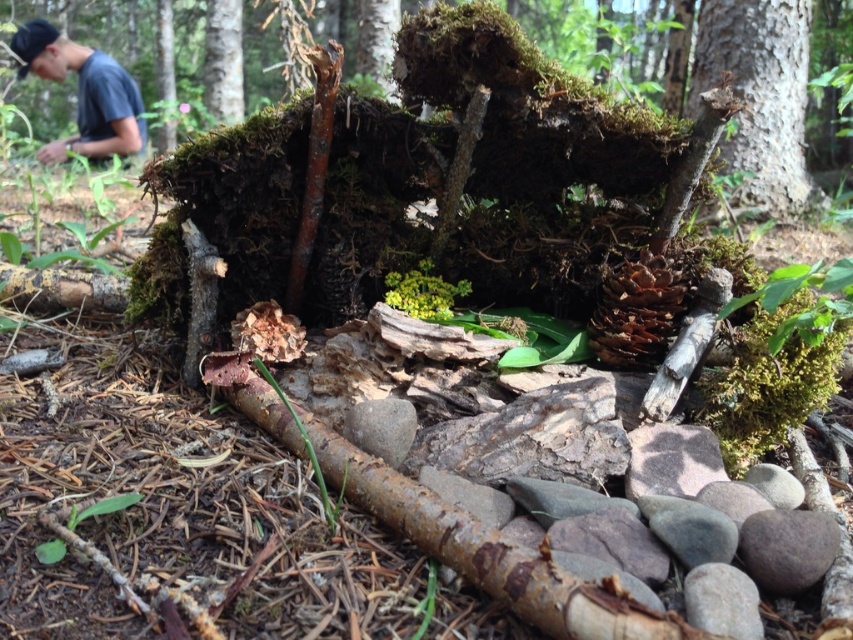
You are an explorer in the forest and you see the green mossy bark at upper right and the white smooth tree trunk at upper left. Which one is positioned lower in the scene?

The green mossy bark at upper right is positioned below the white smooth tree trunk at upper left, so it is lower in the scene.

You are standing in front of a miniature forest shelter. You notice a green mossy bark at upper right and a blue cotton shirt at upper left. Which object is positioned to the right of the other?

The green mossy bark at upper right is to the right of the blue cotton shirt at upper left.

You are an architect designing a miniature forest structure. You have two materials available from the scene, the green mossy bark at upper right and the white smooth tree trunk at upper left. Which material would you choose if you need a taller support beam for your design?

The green mossy bark at upper right has a greater height compared to the white smooth tree trunk at upper left, so it would be the better choice for a taller support beam.